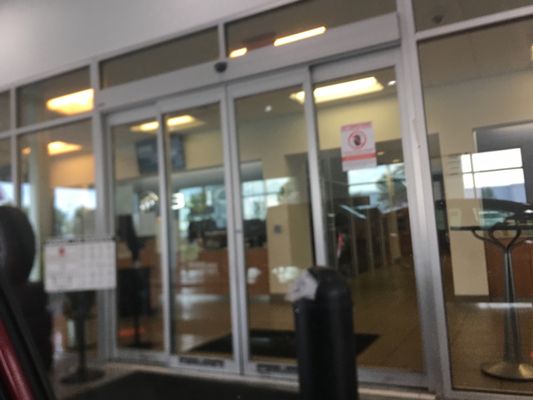
This screenshot has width=533, height=400. Find the location of `trash bin`. trash bin is located at coordinates (340, 357).